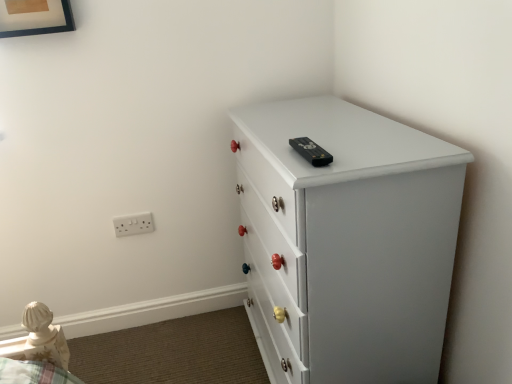
Measure the distance between point [130,215] and camera.

They are 1.67 meters apart.

Identify the location of white plastic electric outlet at lower left. (133, 224).

Find the location of a particular element. white plastic electric outlet at lower left is located at coordinates (133, 224).

Is point (23, 14) closer or farther from the camera than point (343, 148)?

Point (23, 14) is positioned farther from the camera compared to point (343, 148).

From the image's perspective, is wooden picture frame at upper left above white painted wood chest of drawers at upper right?

Correct, wooden picture frame at upper left appears higher than white painted wood chest of drawers at upper right in the image.

From their relative heights in the image, would you say wooden picture frame at upper left is taller or shorter than white painted wood chest of drawers at upper right?

Considering their sizes, wooden picture frame at upper left has less height than white painted wood chest of drawers at upper right.

What's the angular difference between white plastic electric outlet at lower left and white painted wood chest of drawers at upper right's facing directions?

The angular difference between white plastic electric outlet at lower left and white painted wood chest of drawers at upper right is 89.4 degrees.

In terms of height, does white plastic electric outlet at lower left look taller or shorter compared to white painted wood chest of drawers at upper right?

Considering their sizes, white plastic electric outlet at lower left has less height than white painted wood chest of drawers at upper right.

From a real-world perspective, which is physically below, white plastic electric outlet at lower left or white painted wood chest of drawers at upper right?

white painted wood chest of drawers at upper right.

Would you say white plastic electric outlet at lower left is inside or outside white painted wood chest of drawers at upper right?

white plastic electric outlet at lower left is outside white painted wood chest of drawers at upper right.

Is white painted wood chest of drawers at upper right oriented away from wooden picture frame at upper left?

No, wooden picture frame at upper left is not at the back of white painted wood chest of drawers at upper right.

Is white painted wood chest of drawers at upper right next to wooden picture frame at upper left and touching it?

They are not placed beside each other.

Which is in front, point (367, 278) or point (42, 19)?

The point (367, 278) is in front.

Would you say wooden picture frame at upper left is part of white painted wood chest of drawers at upper right's contents?

That's incorrect, wooden picture frame at upper left is not inside white painted wood chest of drawers at upper right.

Considering the sizes of white painted wood chest of drawers at upper right and white plastic electric outlet at lower left in the image, is white painted wood chest of drawers at upper right wider or thinner than white plastic electric outlet at lower left?

Clearly, white painted wood chest of drawers at upper right has more width compared to white plastic electric outlet at lower left.

Is point (404, 247) more distant than point (128, 227)?

No, it is not.

Does white painted wood chest of drawers at upper right have a greater height compared to white plastic electric outlet at lower left?

Correct, white painted wood chest of drawers at upper right is much taller as white plastic electric outlet at lower left.

Where is `electric outlet behind the white painted wood chest of drawers at upper right`? electric outlet behind the white painted wood chest of drawers at upper right is located at coordinates (133, 224).

Is wooden picture frame at upper left situated inside white plastic electric outlet at lower left or outside?

wooden picture frame at upper left exists outside the volume of white plastic electric outlet at lower left.

Can you confirm if wooden picture frame at upper left is taller than white plastic electric outlet at lower left?

Yes.

Find the location of `electric outlet below the wooden picture frame at upper left (from the image's perspective)`. electric outlet below the wooden picture frame at upper left (from the image's perspective) is located at coordinates (133, 224).

From the image's perspective, is wooden picture frame at upper left beneath white plastic electric outlet at lower left?

Incorrect, from the image's perspective, wooden picture frame at upper left is higher than white plastic electric outlet at lower left.

Is white plastic electric outlet at lower left thinner than wooden picture frame at upper left?

Correct, the width of white plastic electric outlet at lower left is less than that of wooden picture frame at upper left.

In the scene shown: Is white plastic electric outlet at lower left taller or shorter than wooden picture frame at upper left?

white plastic electric outlet at lower left is shorter than wooden picture frame at upper left.

Is the depth of white plastic electric outlet at lower left greater than that of wooden picture frame at upper left?

Yes, the depth of white plastic electric outlet at lower left is greater than that of wooden picture frame at upper left.

Is white plastic electric outlet at lower left bigger than wooden picture frame at upper left?

No, white plastic electric outlet at lower left is not bigger than wooden picture frame at upper left.

Find the location of a particular element. The width and height of the screenshot is (512, 384). the chest of drawers that appears below the wooden picture frame at upper left (from the image's perspective) is located at coordinates (347, 241).

Image resolution: width=512 pixels, height=384 pixels. Identify the location of electric outlet on the left side of white painted wood chest of drawers at upper right. (133, 224).

Estimate the real-world distances between objects in this image. Which object is closer to white plastic electric outlet at lower left, wooden picture frame at upper left or white painted wood chest of drawers at upper right?

wooden picture frame at upper left.

Estimate the real-world distances between objects in this image. Which object is closer to wooden picture frame at upper left, white painted wood chest of drawers at upper right or white plastic electric outlet at lower left?

white plastic electric outlet at lower left is positioned closer to the anchor wooden picture frame at upper left.

Which object lies further to the anchor point white painted wood chest of drawers at upper right, wooden picture frame at upper left or white plastic electric outlet at lower left?

wooden picture frame at upper left lies further to white painted wood chest of drawers at upper right than the other object.

When comparing their distances from white plastic electric outlet at lower left, does white painted wood chest of drawers at upper right or wooden picture frame at upper left seem closer?

The object closer to white plastic electric outlet at lower left is wooden picture frame at upper left.

Estimate the real-world distances between objects in this image. Which object is closer to wooden picture frame at upper left, white plastic electric outlet at lower left or white painted wood chest of drawers at upper right?

white plastic electric outlet at lower left is positioned closer to the anchor wooden picture frame at upper left.

Estimate the real-world distances between objects in this image. Which object is closer to white painted wood chest of drawers at upper right, white plastic electric outlet at lower left or wooden picture frame at upper left?

white plastic electric outlet at lower left is positioned closer to the anchor white painted wood chest of drawers at upper right.

The height and width of the screenshot is (384, 512). I want to click on electric outlet between wooden picture frame at upper left and white painted wood chest of drawers at upper right from left to right, so click(133, 224).